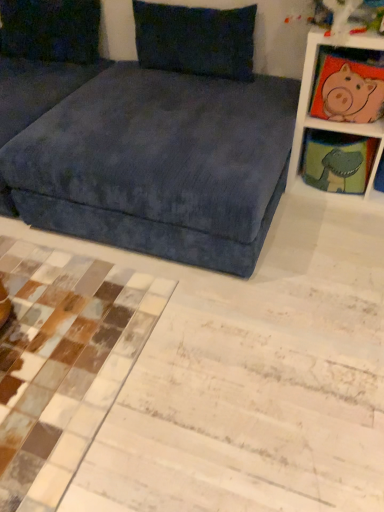
Question: From the image's perspective, is velvet blue studio couch at upper center located above or below white wood shelf at upper right, placed as the first shelf when sorted from top to bottom?

Choices:
 (A) below
 (B) above

Answer: (A)

Question: Is point (86, 96) closer or farther from the camera than point (380, 147)?

Choices:
 (A) closer
 (B) farther

Answer: (B)

Question: Estimate the real-world distances between objects in this image. Which object is closer to the velvet dark blue pillow at upper left, positioned as the 1th pillow in left-to-right order?

Choices:
 (A) velvety dark blue pillow at upper center, marked as the 2th pillow in a left-to-right arrangement
 (B) white wood shelf at upper right, placed as the first shelf when sorted from top to bottom
 (C) velvet blue studio couch at upper center
 (D) matte green fabric at upper right, acting as the first shelf starting from the bottom
 (E) pink fabric pig at upper right

Answer: (A)

Question: Estimate the real-world distances between objects in this image. Which object is closer to the pink fabric pig at upper right?

Choices:
 (A) velvety dark blue pillow at upper center, the first pillow from the right
 (B) white wood shelf at upper right, marked as the second shelf in a bottom-to-top arrangement
 (C) matte green fabric at upper right, acting as the first shelf starting from the bottom
 (D) velvet blue studio couch at upper center
 (E) velvet dark blue pillow at upper left, positioned as the 1th pillow in left-to-right order

Answer: (B)